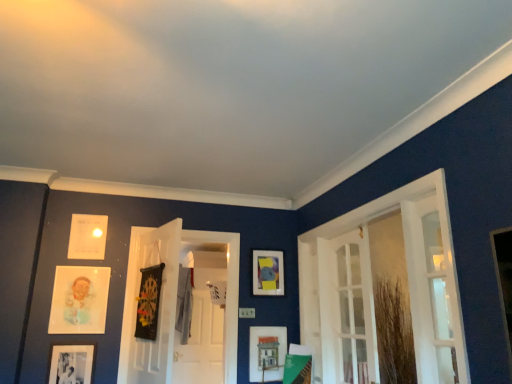
Question: From a real-world perspective, is white glossy door at center positioned over matte black picture frame at lower left, which is counted as the 6th picture frame, starting from the right, based on gravity?

Choices:
 (A) yes
 (B) no

Answer: (A)

Question: Does white glossy door at center appear on the left side of matte black picture frame at lower left, placed as the 1th picture frame when sorted from left to right?

Choices:
 (A) no
 (B) yes

Answer: (A)

Question: Does white glossy door at center have a lesser width compared to matte black picture frame at lower left, which is counted as the 6th picture frame, starting from the right?

Choices:
 (A) yes
 (B) no

Answer: (A)

Question: Is white glossy door at center taller than matte black picture frame at lower left, placed as the 1th picture frame when sorted from left to right?

Choices:
 (A) yes
 (B) no

Answer: (A)

Question: Is matte black picture frame at lower left, which is counted as the 6th picture frame, starting from the right, a part of white glossy door at center?

Choices:
 (A) no
 (B) yes

Answer: (A)

Question: Can you confirm if white glossy door at center is bigger than matte black picture frame at lower left, which is counted as the 6th picture frame, starting from the right?

Choices:
 (A) yes
 (B) no

Answer: (A)

Question: From the image's perspective, is white glass door at right, the second door when ordered from right to left, located beneath white paper at upper left, the 4th picture frame in the right-to-left sequence?

Choices:
 (A) no
 (B) yes

Answer: (B)

Question: Is white glass door at right, the second door when ordered from right to left, oriented away from white paper at upper left, the 3th picture frame when ordered from left to right?

Choices:
 (A) yes
 (B) no

Answer: (B)

Question: Does white glass door at right, the 2th door from the left, appear on the right side of white paper at upper left, the 3th picture frame when ordered from left to right?

Choices:
 (A) yes
 (B) no

Answer: (A)

Question: Is white glass door at right, the 2th door from the left, not close to white paper at upper left, the 3th picture frame when ordered from left to right?

Choices:
 (A) yes
 (B) no

Answer: (A)

Question: Considering the relative positions of white glass door at right, the second door when ordered from right to left, and white paper at upper left, the 4th picture frame in the right-to-left sequence, in the image provided, is white glass door at right, the second door when ordered from right to left, in front of white paper at upper left, the 4th picture frame in the right-to-left sequence,?

Choices:
 (A) yes
 (B) no

Answer: (A)

Question: Considering the relative positions of white glass door at right, the 2th door from the left, and white paper at upper left, the 4th picture frame in the right-to-left sequence, in the image provided, is white glass door at right, the 2th door from the left, behind white paper at upper left, the 4th picture frame in the right-to-left sequence,?

Choices:
 (A) yes
 (B) no

Answer: (B)

Question: Is black matte dartboard at center, the third picture frame viewed from the right, positioned beyond the bounds of matte paper portrait at left, the second picture frame viewed from the left?

Choices:
 (A) yes
 (B) no

Answer: (A)